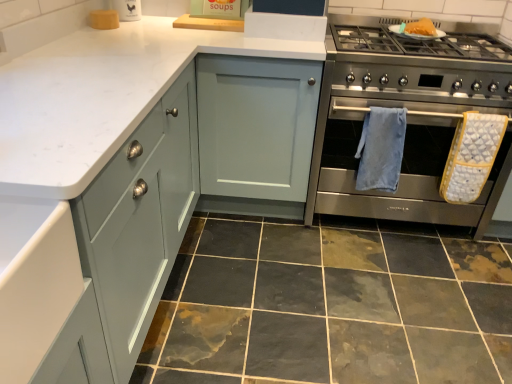
Question: Is white marble countertop at upper left bigger than yellow textured oven mitt at right, placed as the 2th bath towel when sorted from left to right?

Choices:
 (A) no
 (B) yes

Answer: (B)

Question: From the image's perspective, would you say white marble countertop at upper left is positioned over yellow textured oven mitt at right, positioned as the first bath towel in right-to-left order?

Choices:
 (A) yes
 (B) no

Answer: (A)

Question: Is white marble countertop at upper left at the left side of yellow textured oven mitt at right, placed as the 2th bath towel when sorted from left to right?

Choices:
 (A) no
 (B) yes

Answer: (B)

Question: From a real-world perspective, does white marble countertop at upper left sit lower than yellow textured oven mitt at right, positioned as the first bath towel in right-to-left order?

Choices:
 (A) no
 (B) yes

Answer: (B)

Question: Does white marble countertop at upper left have a smaller size compared to yellow textured oven mitt at right, positioned as the first bath towel in right-to-left order?

Choices:
 (A) yes
 (B) no

Answer: (B)

Question: Is yellow textured oven mitt at right, positioned as the first bath towel in right-to-left order, inside or outside of stainless steel oven at right?

Choices:
 (A) inside
 (B) outside

Answer: (A)

Question: From a real-world perspective, is yellow textured oven mitt at right, positioned as the first bath towel in right-to-left order, positioned above or below stainless steel oven at right?

Choices:
 (A) above
 (B) below

Answer: (B)

Question: Is yellow textured oven mitt at right, positioned as the first bath towel in right-to-left order, wider or thinner than stainless steel oven at right?

Choices:
 (A) wide
 (B) thin

Answer: (B)

Question: Is point (500, 122) closer or farther from the camera than point (353, 180)?

Choices:
 (A) farther
 (B) closer

Answer: (B)

Question: From the image's perspective, is blue soft towel at center right, arranged as the 1th bath towel when viewed from the left, located above or below white marble countertop at upper left?

Choices:
 (A) above
 (B) below

Answer: (B)

Question: Is blue soft towel at center right, arranged as the 1th bath towel when viewed from the left, wider or thinner than white marble countertop at upper left?

Choices:
 (A) thin
 (B) wide

Answer: (A)

Question: In terms of size, does blue soft towel at center right, the 2th bath towel positioned from the right, appear bigger or smaller than white marble countertop at upper left?

Choices:
 (A) small
 (B) big

Answer: (A)

Question: Do you think blue soft towel at center right, the 2th bath towel positioned from the right, is within white marble countertop at upper left, or outside of it?

Choices:
 (A) inside
 (B) outside

Answer: (B)

Question: Is white marble countertop at upper left situated inside marble tile at lower center or outside?

Choices:
 (A) outside
 (B) inside

Answer: (A)

Question: Is white marble countertop at upper left taller or shorter than marble tile at lower center?

Choices:
 (A) short
 (B) tall

Answer: (B)